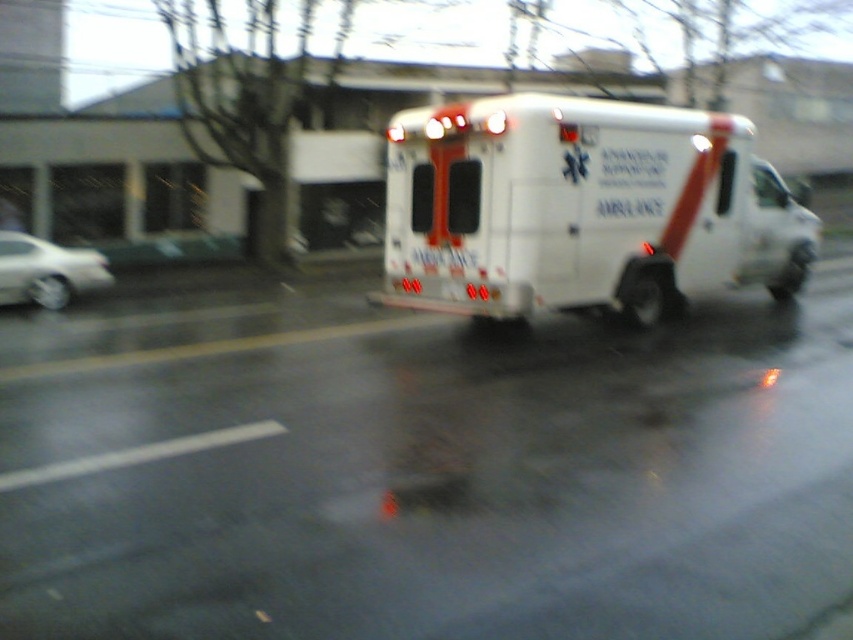
You are a drone operator trying to locate the white glossy ambulance at center in the image. The coordinates given are point A at [582,209]. Can you confirm if point A is exactly where the white glossy ambulance at center is located?

Yes, the point A at [582,209] corresponds to the white glossy ambulance at center, so it is exactly located there.

You are a photographer standing at the camera position. You want to capture a closeup shot of the white glossy ambulance at center. Given that your camera can focus on objects within 10 meters, will you be able to take the photo without moving closer?

The white glossy ambulance at center is 9.40 meters away from the camera, which is within the 10 meters focus range. Therefore, you can take the closeup shot without moving closer.